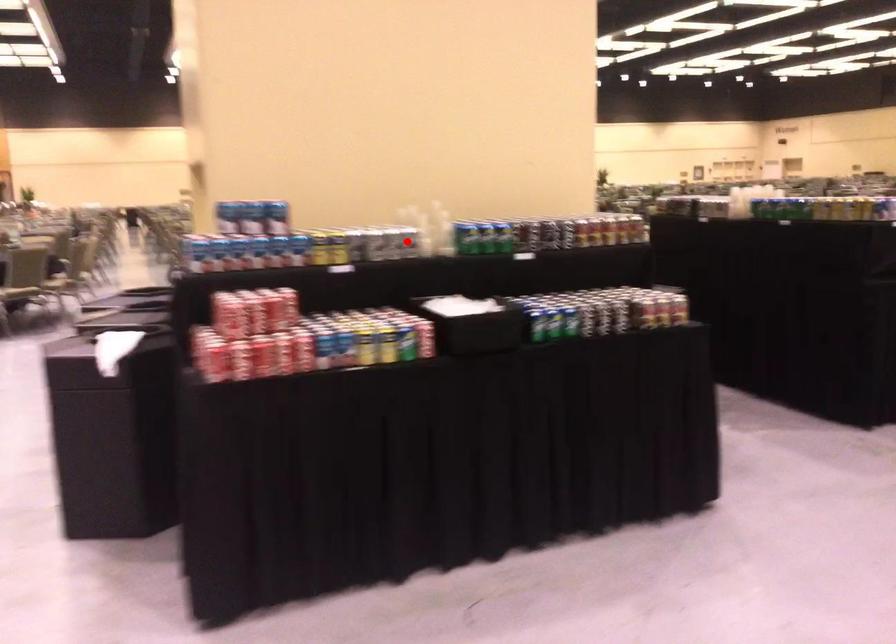
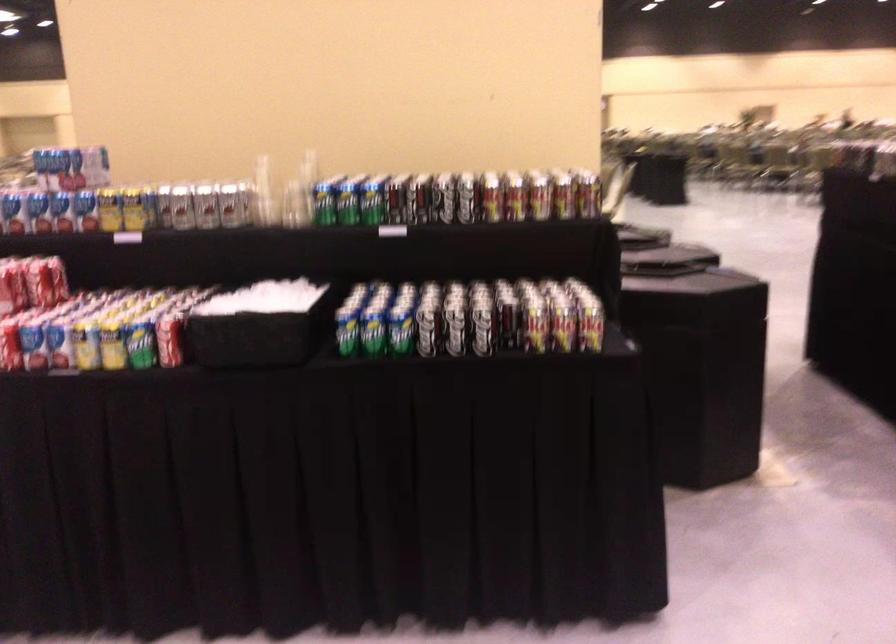
In the second image, find the point that corresponds to the highlighted location in the first image.

(228, 205)